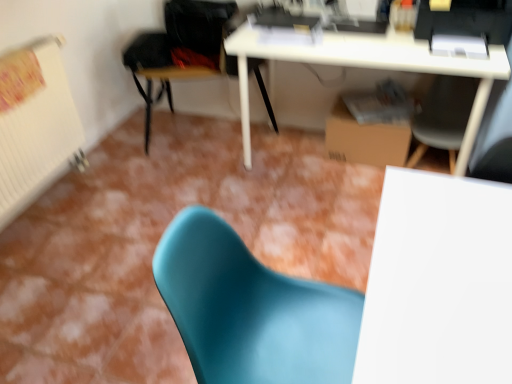
Question: Is matte gray chair at center, positioned as the first chair in right-to-left order, situated inside matte teal chair at lower center, which is the 2th chair from right to left, or outside?

Choices:
 (A) outside
 (B) inside

Answer: (A)

Question: Is matte gray chair at center, positioned as the first chair in right-to-left order, in front of or behind matte teal chair at lower center, acting as the 2th chair starting from the left, in the image?

Choices:
 (A) behind
 (B) front

Answer: (A)

Question: Based on their relative distances, which object is nearer to the matte gray chair at center, marked as the 3th chair in a left-to-right arrangement?

Choices:
 (A) white matte table at center
 (B) brown cardboard box at lower right
 (C) white glossy desk at upper center
 (D) matte teal chair at lower center, the 3th chair when ordered from back to front
 (E) black leather chair at center, acting as the 3th chair starting from the right

Answer: (B)

Question: Which object is the closest to the matte gray chair at center, marked as the 3th chair in a left-to-right arrangement?

Choices:
 (A) brown cardboard box at lower right
 (B) white matte table at center
 (C) black leather chair at center, arranged as the third chair when viewed from the front
 (D) matte teal chair at lower center, the 3th chair when ordered from back to front
 (E) white glossy desk at upper center

Answer: (A)